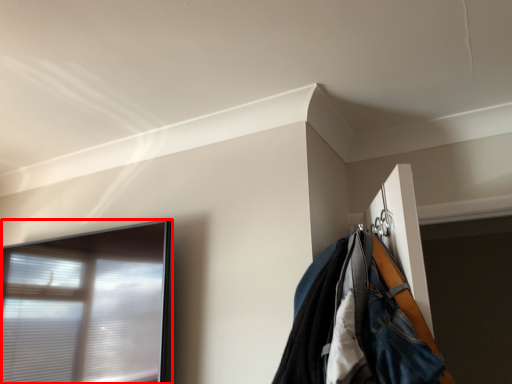
Question: Where is window (annotated by the red box) located in relation to jacket in the image?

Choices:
 (A) left
 (B) right

Answer: (A)